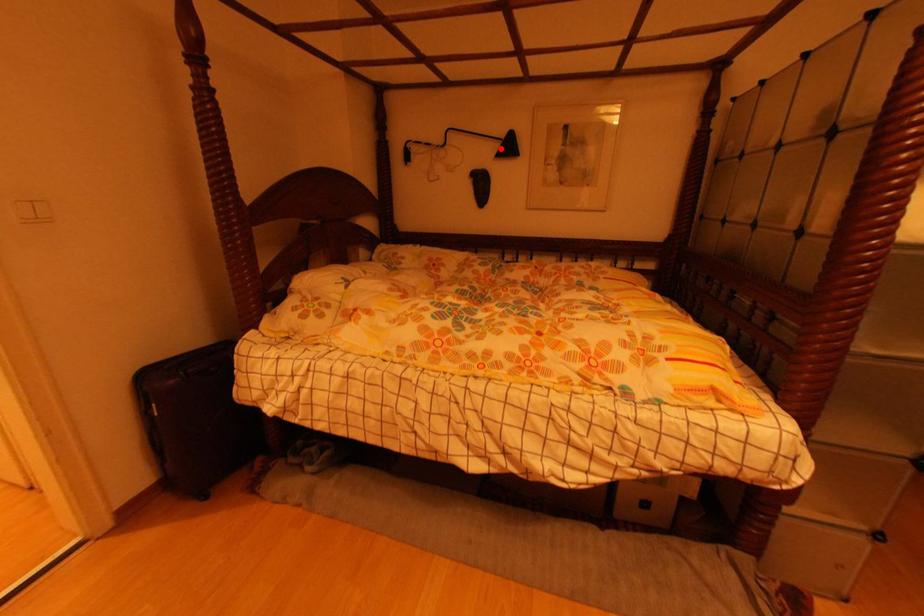
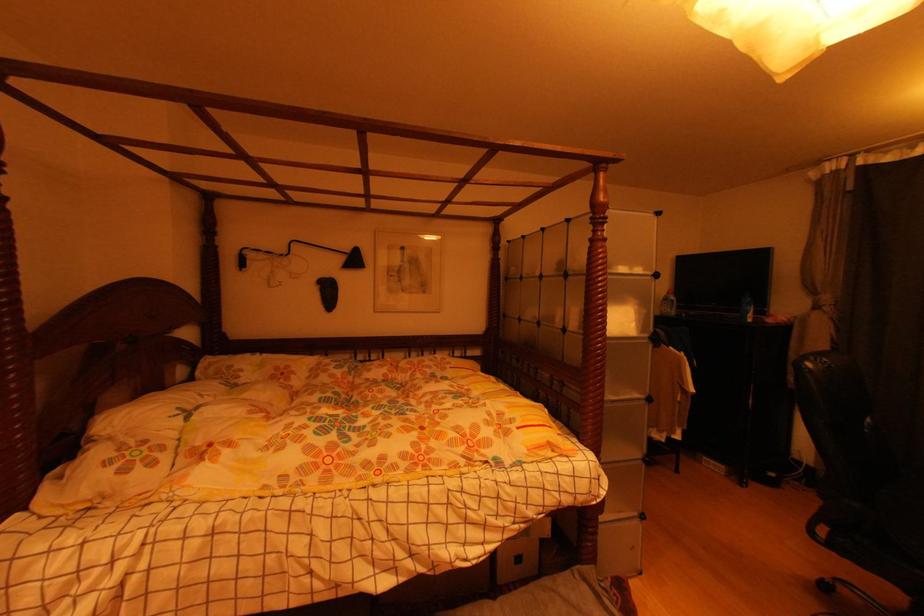
The point at the highlighted location is marked in the first image. Where is the corresponding point in the second image?

(346, 261)